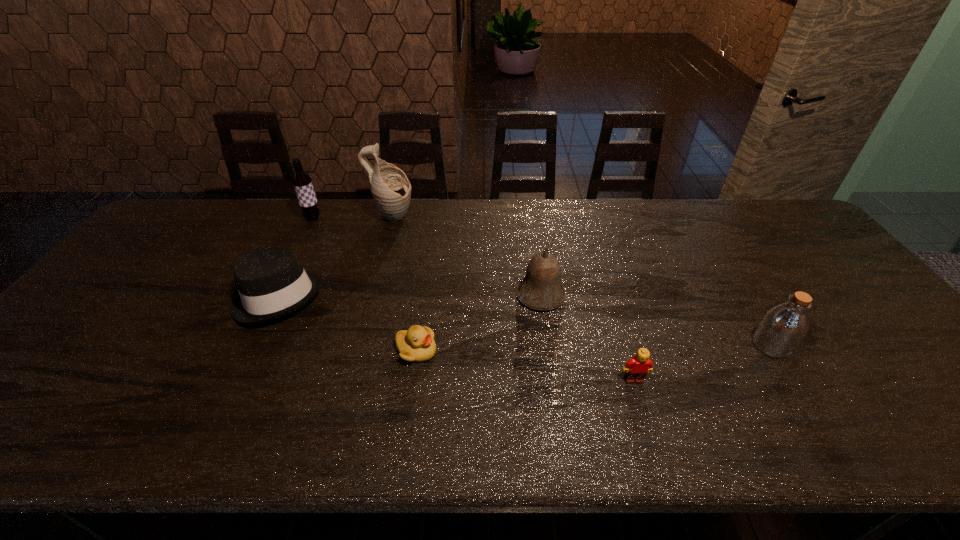
Identify the location of vacant space that's between the bell and the fifth object from right to left. Image resolution: width=960 pixels, height=540 pixels. (467, 256).

The image size is (960, 540). Find the location of `free area in between the rightmost object and the tallest object`. free area in between the rightmost object and the tallest object is located at coordinates (582, 281).

The image size is (960, 540). In order to click on unoccupied position between the pitcher and the Lego in this screenshot , I will do `click(513, 299)`.

Identify the location of unoccupied area between the third shortest object and the pitcher. The height and width of the screenshot is (540, 960). (335, 257).

Identify the location of unoccupied area between the rightmost object and the fifth tallest object. The height and width of the screenshot is (540, 960). (524, 321).

Choose which object is the nearest neighbor to the bell. Please provide its 2D coordinates. Your answer should be formatted as a tuple, i.e. [(x, y)], where the tuple contains the x and y coordinates of a point satisfying the conditions above.

[(637, 368)]

Locate which object ranks second in proximity to the sixth shortest object. Please provide its 2D coordinates. Your answer should be formatted as a tuple, i.e. [(x, y)], where the tuple contains the x and y coordinates of a point satisfying the conditions above.

[(271, 282)]

Where is `blank space that satisfies the following two spatial constraints: 1. at the spout of the tallest object; 2. on the front side of the fedora`? blank space that satisfies the following two spatial constraints: 1. at the spout of the tallest object; 2. on the front side of the fedora is located at coordinates (372, 296).

Find the location of a particular element. Image resolution: width=960 pixels, height=540 pixels. free spot that satisfies the following two spatial constraints: 1. at the spout of the bell; 2. on the right side of the tallest object is located at coordinates (372, 295).